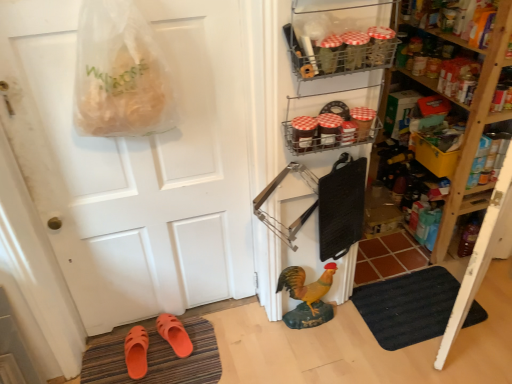
Image resolution: width=512 pixels, height=384 pixels. In order to click on vacant area that is situated to the right of painted wood rooster at lower center in this screenshot , I will do `click(346, 329)`.